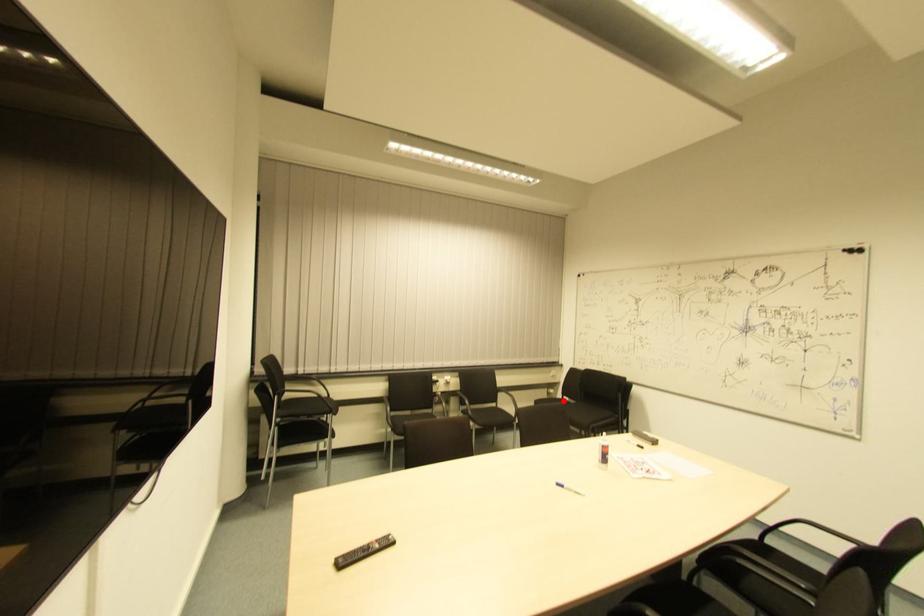
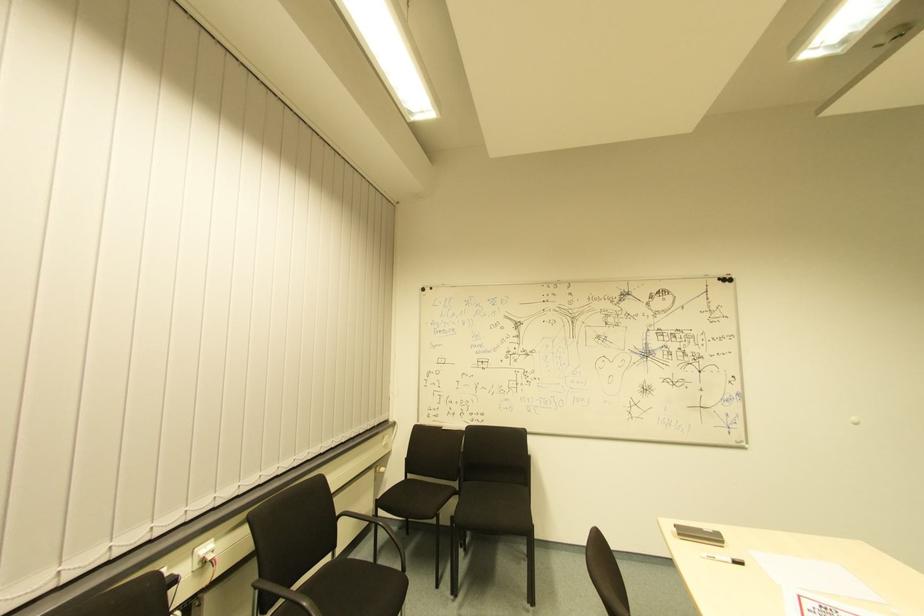
Find the pixel in the second image that matches the highlighted location in the first image.

(408, 479)